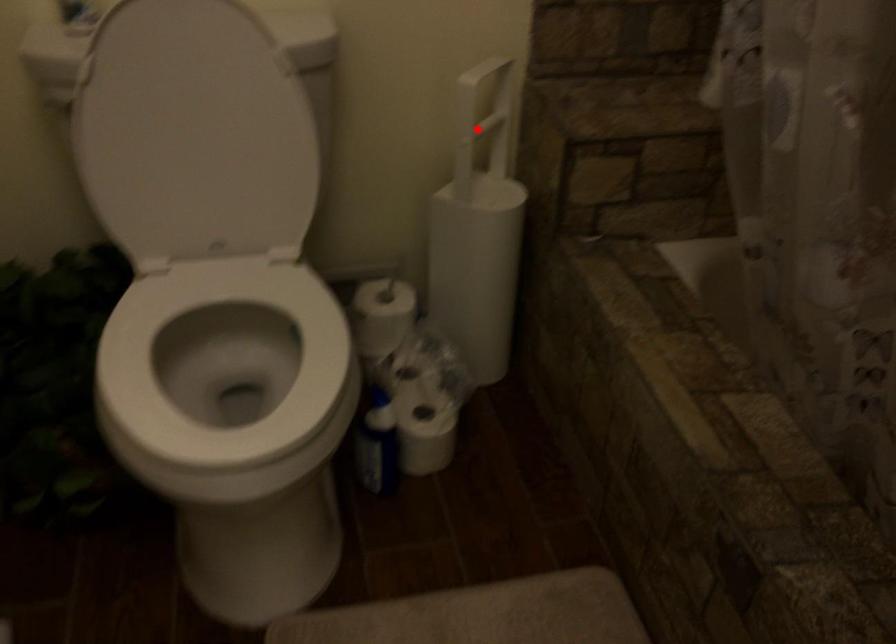
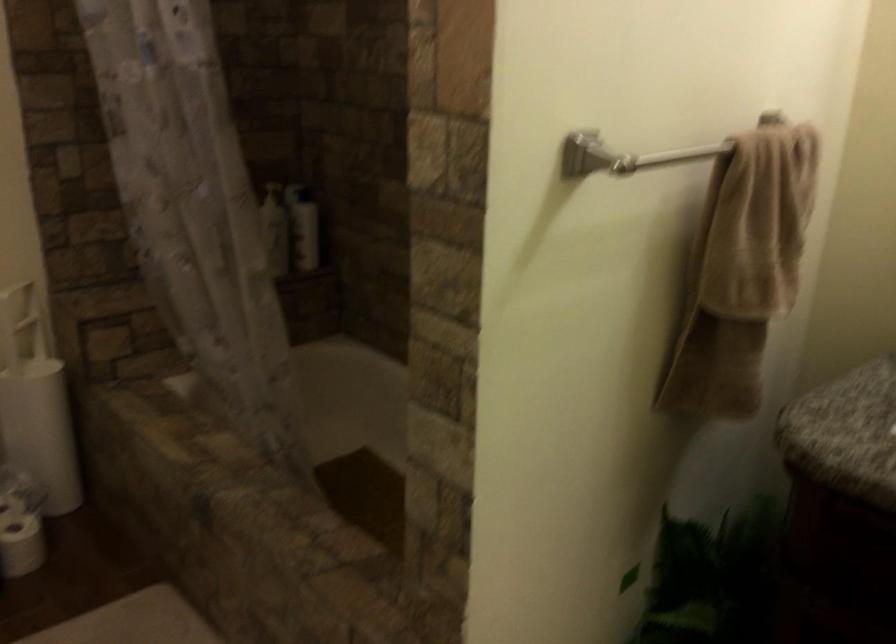
In the second image, find the point that corresponds to the highlighted location in the first image.

(20, 323)